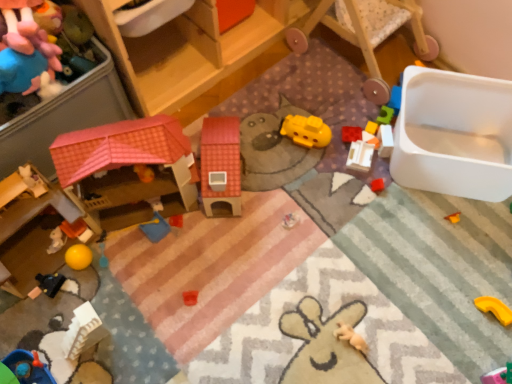
The height and width of the screenshot is (384, 512). In order to click on vacant space that's between yellow matte block at upper right, positioned as the 3th toy in right-to-left order, and matte plastic dollhouse at center-left, the fourth toy viewed from the left in this screenshot , I will do `click(287, 168)`.